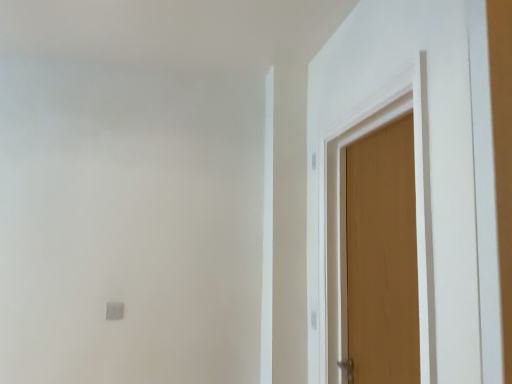
You are a GUI agent. You are given a task and a screenshot of the screen. Output one action in this format:
    pyautogui.click(x=<x>, y=<y>)
    Task: Click on the wooden door at right, acting as the 2th door starting from the left
    
    Given the screenshot: What is the action you would take?
    pyautogui.click(x=382, y=258)

In order to face wooden door at right, acting as the 2th door starting from the left, should I rotate leftwards or rightwards?

Rotate right and turn 16.351 degrees.

Describe the element at coordinates (382, 258) in the screenshot. This screenshot has width=512, height=384. I see `wooden door at right, acting as the 2th door starting from the left` at that location.

What do you see at coordinates (416, 164) in the screenshot?
I see `wooden door at right, the 1th door from the left` at bounding box center [416, 164].

Locate an element on the screen. The image size is (512, 384). wooden door at right, the 1th door from the left is located at coordinates (416, 164).

Measure the distance between wooden door at right, the 1th door from the left, and camera.

The depth of wooden door at right, the 1th door from the left, is 37.96 inches.

Identify the location of wooden door at right, which ranks as the 1th door in right-to-left order. (382, 258).

Is wooden door at right, acting as the 2th door starting from the left, at the left side of wooden door at right, the 2th door positioned from the right?

Incorrect, wooden door at right, acting as the 2th door starting from the left, is not on the left side of wooden door at right, the 2th door positioned from the right.

Considering their positions, is wooden door at right, acting as the 2th door starting from the left, located in front of or behind wooden door at right, the 1th door from the left?

In the image, wooden door at right, acting as the 2th door starting from the left, appears behind wooden door at right, the 1th door from the left.

Which point is more forward, (368, 244) or (315, 225)?

Point (368, 244)

From the image's perspective, between wooden door at right, which ranks as the 1th door in right-to-left order, and wooden door at right, the 1th door from the left, who is located below?

wooden door at right, which ranks as the 1th door in right-to-left order, from the image's perspective.

From a real-world perspective, is wooden door at right, which ranks as the 1th door in right-to-left order, positioned above or below wooden door at right, the 2th door positioned from the right?

From a real-world perspective, wooden door at right, which ranks as the 1th door in right-to-left order, is physically below wooden door at right, the 2th door positioned from the right.

Which object is wider, wooden door at right, acting as the 2th door starting from the left, or wooden door at right, the 2th door positioned from the right?

With larger width is wooden door at right, acting as the 2th door starting from the left.

Does wooden door at right, which ranks as the 1th door in right-to-left order, have a lesser height compared to wooden door at right, the 2th door positioned from the right?

Yes.

Which of these two, wooden door at right, acting as the 2th door starting from the left, or wooden door at right, the 2th door positioned from the right, is bigger?

With larger size is wooden door at right, acting as the 2th door starting from the left.

Is wooden door at right, which ranks as the 1th door in right-to-left order, inside or outside of wooden door at right, the 2th door positioned from the right?

wooden door at right, which ranks as the 1th door in right-to-left order, is spatially situated outside wooden door at right, the 2th door positioned from the right.

Is wooden door at right, acting as the 2th door starting from the left, not close to wooden door at right, the 2th door positioned from the right?

They are positioned close to each other.

Could you tell me if wooden door at right, acting as the 2th door starting from the left, is turned towards wooden door at right, the 1th door from the left?

Yes, wooden door at right, acting as the 2th door starting from the left, is aimed at wooden door at right, the 1th door from the left.

How different are the orientations of wooden door at right, which ranks as the 1th door in right-to-left order, and wooden door at right, the 2th door positioned from the right, in degrees?

1.32 degrees separate the facing orientations of wooden door at right, which ranks as the 1th door in right-to-left order, and wooden door at right, the 2th door positioned from the right.

At what (x,y) coordinates should I click in order to perform the action: click on door above the wooden door at right, acting as the 2th door starting from the left (from the image's perspective). Please return your answer as a coordinate pair (x, y). The height and width of the screenshot is (384, 512). Looking at the image, I should click on (416, 164).

Considering the positions of objects wooden door at right, the 2th door positioned from the right, and wooden door at right, which ranks as the 1th door in right-to-left order, in the image provided, who is more to the left, wooden door at right, the 2th door positioned from the right, or wooden door at right, which ranks as the 1th door in right-to-left order,?

Positioned to the left is wooden door at right, the 2th door positioned from the right.

Is the position of wooden door at right, the 2th door positioned from the right, more distant than that of wooden door at right, which ranks as the 1th door in right-to-left order?

No.

Is point (454, 272) more distant than point (402, 168)?

No, (454, 272) is in front of (402, 168).

From the image's perspective, is wooden door at right, the 1th door from the left, beneath wooden door at right, acting as the 2th door starting from the left?

Actually, wooden door at right, the 1th door from the left, appears above wooden door at right, acting as the 2th door starting from the left, in the image.

From a real-world perspective, is wooden door at right, the 2th door positioned from the right, positioned over wooden door at right, acting as the 2th door starting from the left, based on gravity?

Indeed, from a real-world perspective, wooden door at right, the 2th door positioned from the right, stands above wooden door at right, acting as the 2th door starting from the left.

Can you confirm if wooden door at right, the 1th door from the left, is wider than wooden door at right, which ranks as the 1th door in right-to-left order?

No.

From their relative heights in the image, would you say wooden door at right, the 1th door from the left, is taller or shorter than wooden door at right, which ranks as the 1th door in right-to-left order?

Considering their sizes, wooden door at right, the 1th door from the left, has more height than wooden door at right, which ranks as the 1th door in right-to-left order.

Is wooden door at right, the 2th door positioned from the right, bigger or smaller than wooden door at right, acting as the 2th door starting from the left?

In the image, wooden door at right, the 2th door positioned from the right, appears to be smaller than wooden door at right, acting as the 2th door starting from the left.

Would you say wooden door at right, the 1th door from the left, contains wooden door at right, acting as the 2th door starting from the left?

No.

Is wooden door at right, the 1th door from the left, in contact with wooden door at right, acting as the 2th door starting from the left?

wooden door at right, the 1th door from the left, and wooden door at right, acting as the 2th door starting from the left, are clearly separated.

Is wooden door at right, the 1th door from the left, oriented away from wooden door at right, which ranks as the 1th door in right-to-left order?

Correct, wooden door at right, the 1th door from the left, is looking away from wooden door at right, which ranks as the 1th door in right-to-left order.

What's the angular difference between wooden door at right, the 2th door positioned from the right, and wooden door at right, which ranks as the 1th door in right-to-left order,'s facing directions?

The angular difference between wooden door at right, the 2th door positioned from the right, and wooden door at right, which ranks as the 1th door in right-to-left order, is 1.32 degrees.

How much distance is there between wooden door at right, the 2th door positioned from the right, and wooden door at right, acting as the 2th door starting from the left?

A distance of 8.83 inches exists between wooden door at right, the 2th door positioned from the right, and wooden door at right, acting as the 2th door starting from the left.

Locate an element on the screen. The width and height of the screenshot is (512, 384). door above the wooden door at right, which ranks as the 1th door in right-to-left order (from a real-world perspective) is located at coordinates (416, 164).

At what (x,y) coordinates should I click in order to perform the action: click on door lying above the wooden door at right, which ranks as the 1th door in right-to-left order (from the image's perspective). Please return your answer as a coordinate pair (x, y). This screenshot has width=512, height=384. Looking at the image, I should click on (416, 164).

At what (x,y) coordinates should I click in order to perform the action: click on door beneath the wooden door at right, the 1th door from the left (from a real-world perspective). Please return your answer as a coordinate pair (x, y). This screenshot has height=384, width=512. Looking at the image, I should click on click(x=382, y=258).